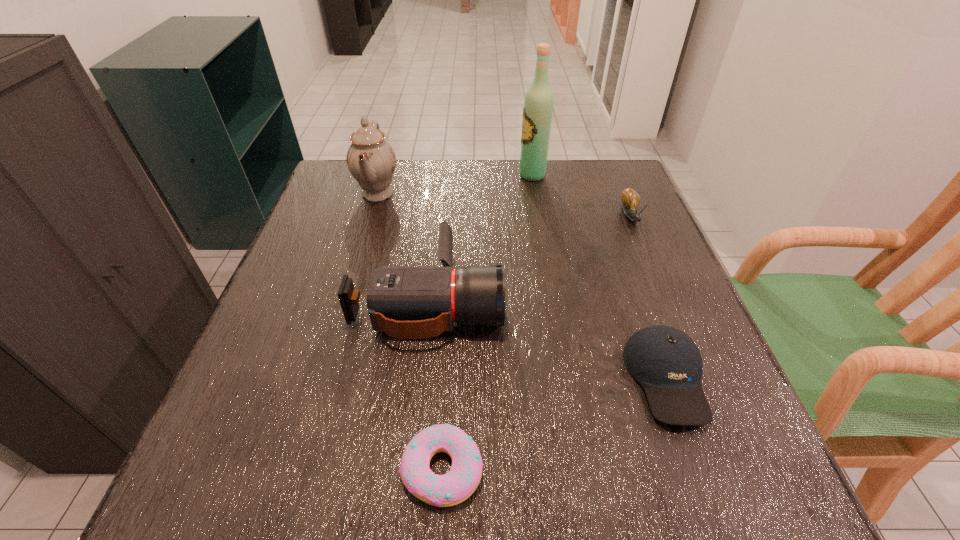
Image resolution: width=960 pixels, height=540 pixels. Find the location of `baseball cap located at the right edge`. baseball cap located at the right edge is located at coordinates (667, 363).

Where is `escargot that is positioned at the right edge`? escargot that is positioned at the right edge is located at coordinates (630, 198).

Where is `object located at the far left corner`? The image size is (960, 540). object located at the far left corner is located at coordinates (371, 160).

Where is `object that is positioned at the far right corner`? The width and height of the screenshot is (960, 540). object that is positioned at the far right corner is located at coordinates (630, 198).

This screenshot has width=960, height=540. In the image, there is a desktop. In order to click on vacant space at the far edge in this screenshot , I will do `click(428, 207)`.

In the image, there is a desktop. Where is `free region at the near edge`? The height and width of the screenshot is (540, 960). free region at the near edge is located at coordinates (479, 488).

This screenshot has width=960, height=540. I want to click on free space at the left edge of the desktop, so click(x=265, y=400).

What are the coordinates of `vacant space at the right edge of the desktop` in the screenshot? It's located at (723, 378).

At what (x,y) coordinates should I click in order to perform the action: click on vacant region at the far left corner of the desktop. Please return your answer as a coordinate pair (x, y). Looking at the image, I should click on (357, 187).

This screenshot has height=540, width=960. What are the coordinates of `free space at the near left corner of the desktop` in the screenshot? It's located at (283, 475).